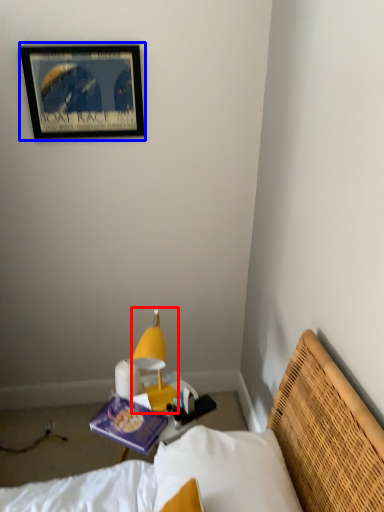
Question: Which of the following is the closest to the observer, lamp (highlighted by a red box) or picture frame (highlighted by a blue box)?

Choices:
 (A) lamp
 (B) picture frame

Answer: (A)